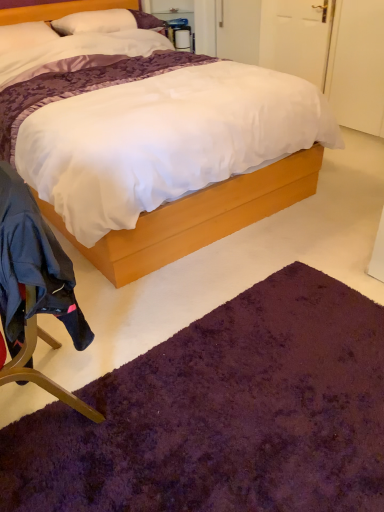
Question: Is dark blue fabric chair at lower left aimed at white soft pillow at upper left?

Choices:
 (A) no
 (B) yes

Answer: (A)

Question: Can you confirm if dark blue fabric chair at lower left is taller than white soft pillow at upper left?

Choices:
 (A) yes
 (B) no

Answer: (A)

Question: From the image's perspective, is dark blue fabric chair at lower left located beneath white soft pillow at upper left?

Choices:
 (A) no
 (B) yes

Answer: (B)

Question: Is dark blue fabric chair at lower left beside white soft pillow at upper left?

Choices:
 (A) yes
 (B) no

Answer: (B)

Question: Can you confirm if dark blue fabric chair at lower left is positioned to the left of white soft pillow at upper left?

Choices:
 (A) no
 (B) yes

Answer: (A)

Question: Considering the relative positions of dark blue fabric chair at lower left and white soft pillow at upper left in the image provided, is dark blue fabric chair at lower left to the right of white soft pillow at upper left from the viewer's perspective?

Choices:
 (A) yes
 (B) no

Answer: (A)

Question: Does purple plush rug at lower center have a greater width compared to white matte door at upper right?

Choices:
 (A) yes
 (B) no

Answer: (A)

Question: Is purple plush rug at lower center oriented towards white matte door at upper right?

Choices:
 (A) yes
 (B) no

Answer: (B)

Question: From the image's perspective, is purple plush rug at lower center located above white matte door at upper right?

Choices:
 (A) no
 (B) yes

Answer: (A)

Question: Is white matte door at upper right completely or partially inside purple plush rug at lower center?

Choices:
 (A) no
 (B) yes

Answer: (A)

Question: Are purple plush rug at lower center and white matte door at upper right making contact?

Choices:
 (A) yes
 (B) no

Answer: (B)

Question: Is purple plush rug at lower center not within white matte door at upper right?

Choices:
 (A) yes
 (B) no

Answer: (A)

Question: Is purple shaggy rug at lower center thinner than white matte door at upper right?

Choices:
 (A) yes
 (B) no

Answer: (B)